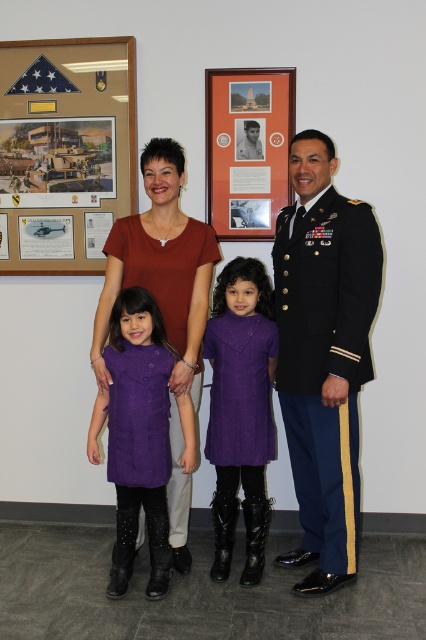
Consider the image. Is purple woolen dress at center to the right of shiny black uniform at right from the viewer's perspective?

Indeed, purple woolen dress at center is positioned on the right side of shiny black uniform at right.

Between purple woolen dress at center and shiny black uniform at right, which one has less height?

shiny black uniform at right

Which is behind, point (316, 317) or point (244, 152)?

Positioned behind is point (244, 152).

This screenshot has height=640, width=426. What are the coordinates of `purple woolen dress at center` in the screenshot? It's located at (325, 349).

How far apart are matte black flag at upper left and shiny black uniform at right?

A distance of 78.80 centimeters exists between matte black flag at upper left and shiny black uniform at right.

Between matte black flag at upper left and shiny black uniform at right, which one appears on the left side from the viewer's perspective?

From the viewer's perspective, matte black flag at upper left appears more on the left side.

Locate an element on the screen. Image resolution: width=426 pixels, height=640 pixels. matte black flag at upper left is located at coordinates (65, 150).

Is purple woolen dress at center above navy blue wool military uniform at right?

Indeed, purple woolen dress at center is positioned over navy blue wool military uniform at right.

In the scene shown: Does purple woolen dress at center have a lesser height compared to navy blue wool military uniform at right?

In fact, purple woolen dress at center may be taller than navy blue wool military uniform at right.

I want to click on purple woolen dress at center, so click(325, 349).